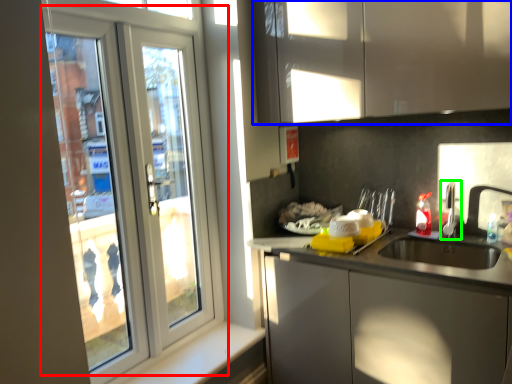
Question: Which object is the closest to the door (highlighted by a red box)? Choose among these: cabinetry (highlighted by a blue box) or tap (highlighted by a green box).

Choices:
 (A) cabinetry
 (B) tap

Answer: (A)